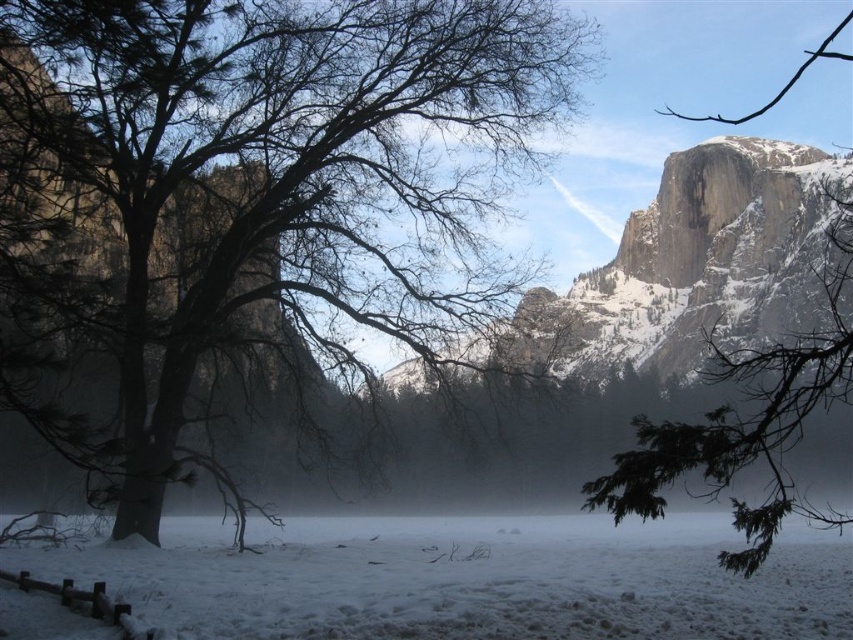
Question: Can you confirm if white snow at center is wider than green leafy branch at upper right?

Choices:
 (A) yes
 (B) no

Answer: (A)

Question: Which object is positioned farthest from the green leafy branch at upper right?

Choices:
 (A) brown/dry wood tree at left
 (B) white snow at center

Answer: (A)

Question: Can you confirm if white snow at center is thinner than green leafy branch at upper right?

Choices:
 (A) yes
 (B) no

Answer: (B)

Question: Does white snow at center have a lesser width compared to green leafy branch at upper right?

Choices:
 (A) yes
 (B) no

Answer: (B)

Question: Which object is closer to the camera taking this photo?

Choices:
 (A) brown/dry wood tree at left
 (B) white snow at center
 (C) green leafy branch at upper right

Answer: (C)

Question: Which is farther from the brown/dry wood tree at left?

Choices:
 (A) white snow at center
 (B) green leafy branch at upper right

Answer: (B)